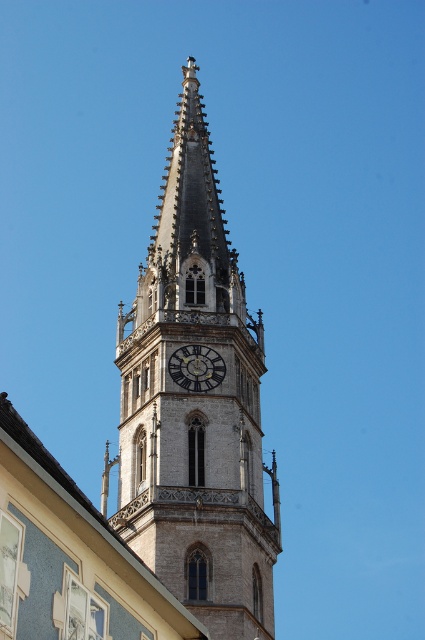
Question: Does stone clock tower at center appear under gold metallic clock at center?

Choices:
 (A) no
 (B) yes

Answer: (A)

Question: Does stone clock tower at center appear over gold metallic clock at center?

Choices:
 (A) no
 (B) yes

Answer: (B)

Question: Is stone clock tower at center positioned at the back of gold metallic clock at center?

Choices:
 (A) no
 (B) yes

Answer: (A)

Question: Among these objects, which one is farthest from the camera?

Choices:
 (A) stone clock tower at center
 (B) gold metallic clock at center

Answer: (B)

Question: Which object is farther from the camera taking this photo?

Choices:
 (A) stone clock tower at center
 (B) gold metallic clock at center

Answer: (B)